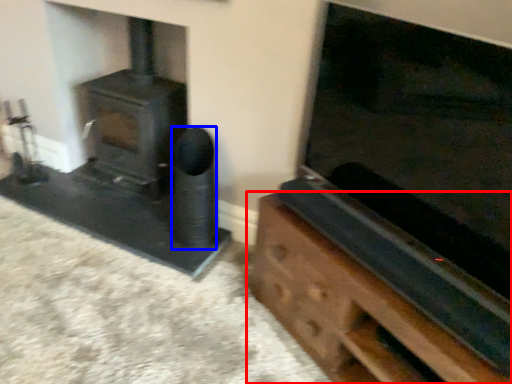
Question: Which object appears closest to the camera in this image, furniture (highlighted by a red box) or speaker (highlighted by a blue box)?

Choices:
 (A) furniture
 (B) speaker

Answer: (A)